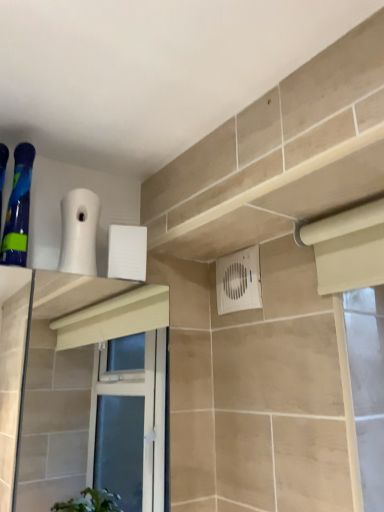
Describe the element at coordinates (238, 281) in the screenshot. The image size is (384, 512). I see `white plastic air conditioning unit at center` at that location.

Where is `white plastic air conditioning unit at center`? white plastic air conditioning unit at center is located at coordinates (238, 281).

Identify the location of white plastic air conditioning unit at center. The width and height of the screenshot is (384, 512). (238, 281).